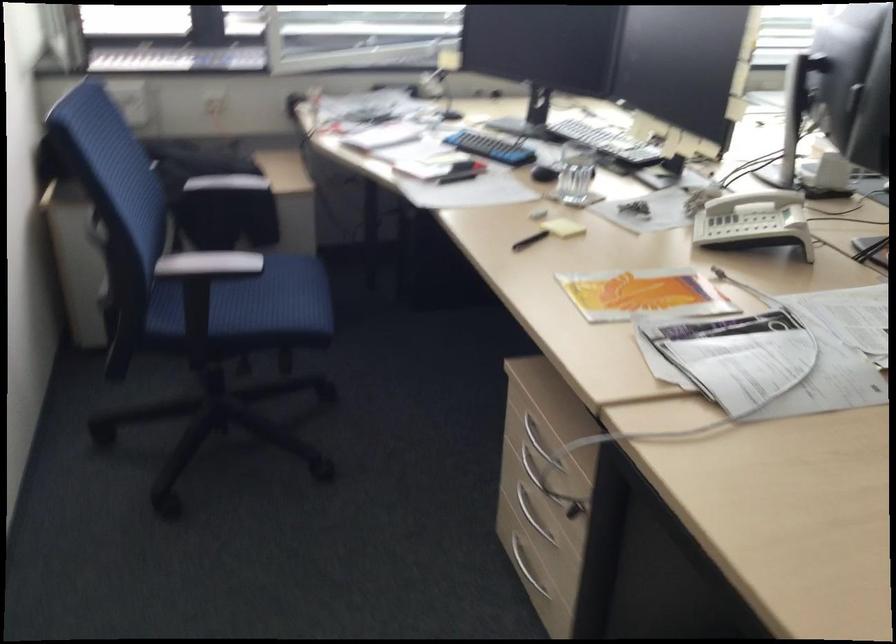
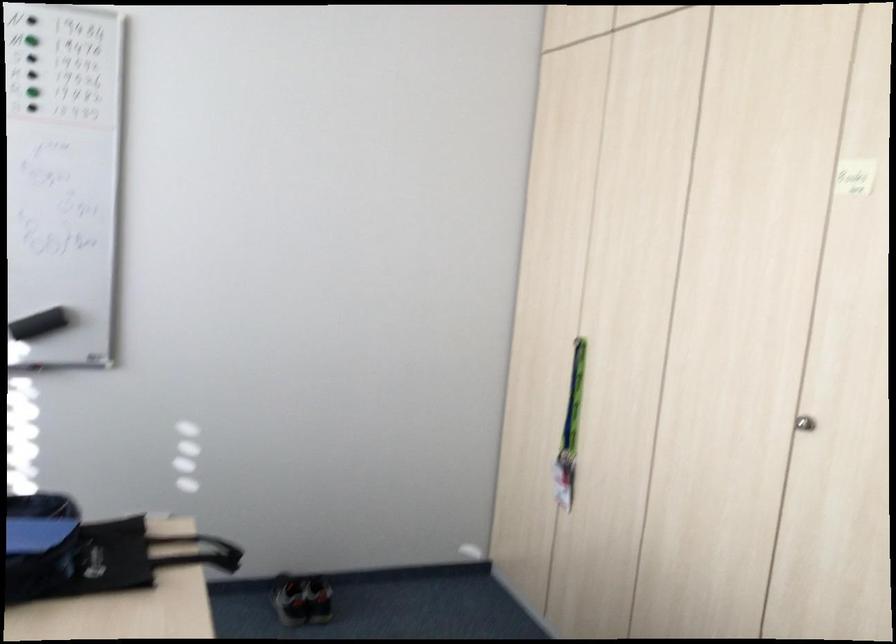
Question: The first image is from the beginning of the video and the second image is from the end. How did the camera likely rotate when shooting the video?

Choices:
 (A) Left
 (B) Right
 (C) Up
 (D) Down

Answer: (B)